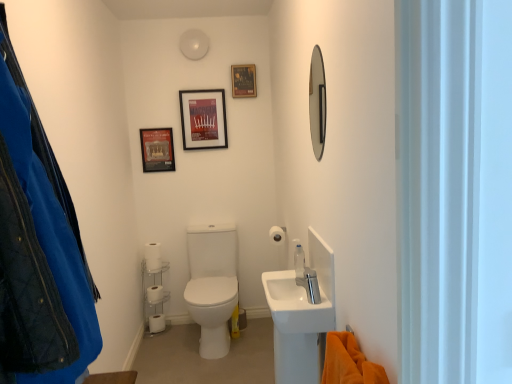
Question: Should I look upward or downward to see white matte toilet paper at lower left, which appears as the second toilet paper when viewed from the front?

Choices:
 (A) up
 (B) down

Answer: (B)

Question: Is shiny silver mirror at upper right not near metallic poster at upper center, positioned as the third picture frame in left-to-right order?

Choices:
 (A) no
 (B) yes

Answer: (B)

Question: From the image's perspective, is shiny silver mirror at upper right located beneath metallic poster at upper center, the 1th picture frame when ordered from right to left?

Choices:
 (A) yes
 (B) no

Answer: (A)

Question: From a real-world perspective, is shiny silver mirror at upper right located beneath metallic poster at upper center, positioned as the third picture frame in left-to-right order?

Choices:
 (A) yes
 (B) no

Answer: (A)

Question: Can you confirm if shiny silver mirror at upper right is wider than metallic poster at upper center, the 1th picture frame when ordered from right to left?

Choices:
 (A) no
 (B) yes

Answer: (A)

Question: Is shiny silver mirror at upper right outside metallic poster at upper center, the 1th picture frame when ordered from right to left?

Choices:
 (A) no
 (B) yes

Answer: (B)

Question: Considering the relative sizes of shiny silver mirror at upper right and metallic poster at upper center, positioned as the third picture frame in left-to-right order, in the image provided, is shiny silver mirror at upper right shorter than metallic poster at upper center, positioned as the third picture frame in left-to-right order,?

Choices:
 (A) no
 (B) yes

Answer: (A)

Question: Could white matte toilet paper at lower left, which is counted as the 2th toilet paper, starting from the bottom, be considered to be inside matte black picture frame at upper left, placed as the 3th picture frame when sorted from right to left?

Choices:
 (A) yes
 (B) no

Answer: (B)

Question: From a real-world perspective, is matte black picture frame at upper left, which is the 1th picture frame from left to right, physically above white matte toilet paper at lower left, placed as the fourth toilet paper when sorted from right to left?

Choices:
 (A) yes
 (B) no

Answer: (A)

Question: Does matte black picture frame at upper left, placed as the 3th picture frame when sorted from right to left, have a lesser height compared to white matte toilet paper at lower left, which is the 1th toilet paper in left-to-right order?

Choices:
 (A) no
 (B) yes

Answer: (A)

Question: From a real-world perspective, is matte black picture frame at upper left, placed as the 3th picture frame when sorted from right to left, located beneath white matte toilet paper at lower left, which is the 1th toilet paper in left-to-right order?

Choices:
 (A) no
 (B) yes

Answer: (A)

Question: Is matte black picture frame at upper left, placed as the 3th picture frame when sorted from right to left, turned away from white matte toilet paper at lower left, which is counted as the 2th toilet paper, starting from the bottom?

Choices:
 (A) yes
 (B) no

Answer: (B)

Question: Considering the relative sizes of matte black picture frame at upper left, placed as the 3th picture frame when sorted from right to left, and white matte toilet paper at lower left, placed as the fourth toilet paper when sorted from right to left, in the image provided, is matte black picture frame at upper left, placed as the 3th picture frame when sorted from right to left, thinner than white matte toilet paper at lower left, placed as the fourth toilet paper when sorted from right to left,?

Choices:
 (A) no
 (B) yes

Answer: (B)

Question: Considering the relative sizes of white matte toilet paper at center, positioned as the 1th toilet paper in front-to-back order, and white matte toilet paper at lower left, marked as the second toilet paper in a back-to-front arrangement, in the image provided, is white matte toilet paper at center, positioned as the 1th toilet paper in front-to-back order, thinner than white matte toilet paper at lower left, marked as the second toilet paper in a back-to-front arrangement,?

Choices:
 (A) yes
 (B) no

Answer: (A)